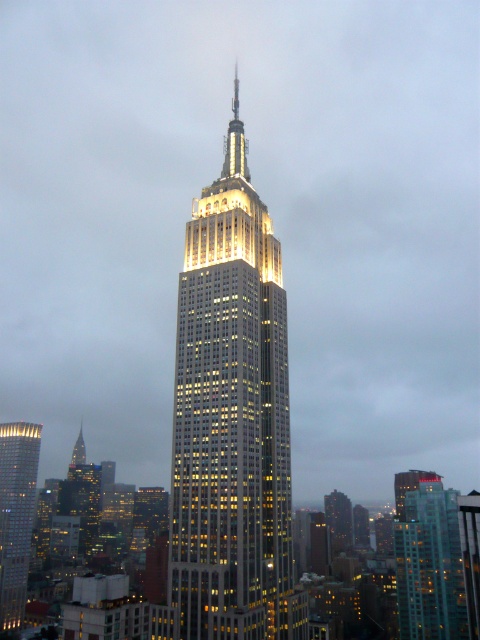
Question: From the image, what is the correct spatial relationship of teal glass building at center in relation to matte glass skyscraper at left?

Choices:
 (A) above
 (B) below

Answer: (A)

Question: From the image, what is the correct spatial relationship of teal glass building at center in relation to matte glass skyscraper at left?

Choices:
 (A) below
 (B) above

Answer: (B)

Question: Considering the real-world distances, which object is farthest from the teal glass building at center?

Choices:
 (A) illuminated glass skyscraper at center
 (B) matte glass skyscraper at left

Answer: (B)

Question: Which point is farther to the camera?

Choices:
 (A) teal glass building at center
 (B) illuminated glass skyscraper at center

Answer: (A)

Question: Is teal glass building at center below matte glass skyscraper at left?

Choices:
 (A) yes
 (B) no

Answer: (B)

Question: Which of the following is the farthest from the observer?

Choices:
 (A) (22, 440)
 (B) (287, 509)

Answer: (A)